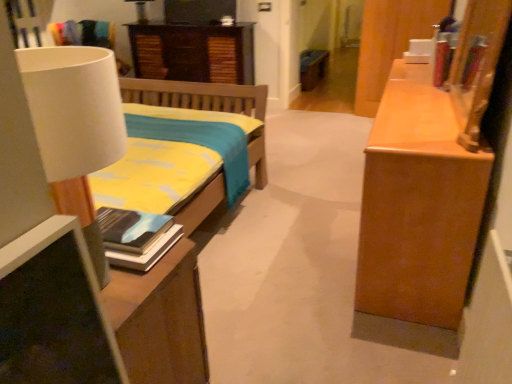
Question: Can you confirm if wooden cabinet at right, the 1th cabinetry when ordered from front to back, is wider than matte white lampshade at upper left, which appears as the 2th lamp when viewed from the right?

Choices:
 (A) no
 (B) yes

Answer: (A)

Question: Are wooden cabinet at right, which ranks as the 2th cabinetry in left-to-right order, and matte white lampshade at upper left, placed as the 1th lamp when sorted from top to bottom, located far from each other?

Choices:
 (A) no
 (B) yes

Answer: (B)

Question: From the image's perspective, is wooden cabinet at right, which ranks as the 2th cabinetry in left-to-right order, located above matte white lampshade at upper left, which is the 2th lamp from bottom to top?

Choices:
 (A) no
 (B) yes

Answer: (A)

Question: Is wooden cabinet at right, the 2th cabinetry from the back, outside matte white lampshade at upper left, which ranks as the 1th lamp in back-to-front order?

Choices:
 (A) yes
 (B) no

Answer: (A)

Question: Is wooden cabinet at right, the 1th cabinetry when ordered from front to back, surrounding matte white lampshade at upper left, which appears as the 2th lamp when viewed from the right?

Choices:
 (A) yes
 (B) no

Answer: (B)

Question: Does wooden cabinet at right, the 2th cabinetry from the back, have a lesser width compared to matte white lampshade at upper left, placed as the 1th lamp when sorted from top to bottom?

Choices:
 (A) no
 (B) yes

Answer: (B)

Question: Can you confirm if wooden cabinet at center, arranged as the second cabinetry when viewed from the front, is shorter than hardcover book at left?

Choices:
 (A) yes
 (B) no

Answer: (B)

Question: Is wooden cabinet at center, which ranks as the 1th cabinetry in back-to-front order, far away from hardcover book at left?

Choices:
 (A) no
 (B) yes

Answer: (B)

Question: Does wooden cabinet at center, arranged as the second cabinetry when viewed from the front, lie behind hardcover book at left?

Choices:
 (A) yes
 (B) no

Answer: (A)

Question: Considering the relative sizes of wooden cabinet at center, arranged as the second cabinetry when viewed from the front, and hardcover book at left in the image provided, is wooden cabinet at center, arranged as the second cabinetry when viewed from the front, bigger than hardcover book at left?

Choices:
 (A) yes
 (B) no

Answer: (A)

Question: Considering the relative positions of wooden cabinet at center, which is counted as the first cabinetry, starting from the left, and hardcover book at left in the image provided, is wooden cabinet at center, which is counted as the first cabinetry, starting from the left, to the left of hardcover book at left from the viewer's perspective?

Choices:
 (A) no
 (B) yes

Answer: (A)

Question: Can you confirm if wooden cabinet at center, which is counted as the first cabinetry, starting from the left, is smaller than hardcover book at left?

Choices:
 (A) yes
 (B) no

Answer: (B)

Question: Can you confirm if white matte lamp at left, which is the second lamp from top to bottom, is smaller than hardcover book at left?

Choices:
 (A) no
 (B) yes

Answer: (A)